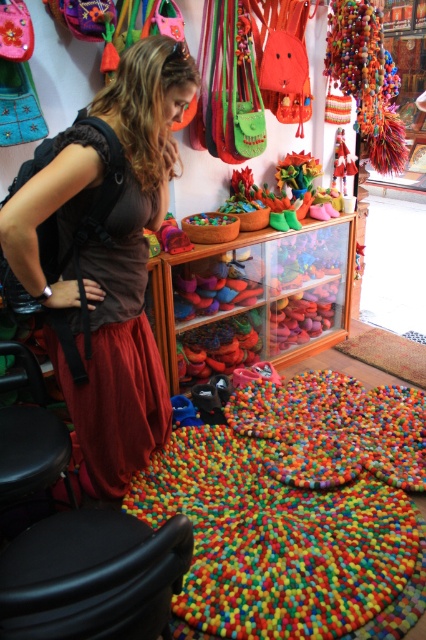
Question: Is black plastic stool at lower left wider than black leather stool at lower left?

Choices:
 (A) yes
 (B) no

Answer: (A)

Question: Can you confirm if brown fabric skirt at center is positioned above black leather stool at lower left?

Choices:
 (A) yes
 (B) no

Answer: (A)

Question: Which of these objects is positioned farthest from the black leather stool at lower left?

Choices:
 (A) black plastic stool at lower left
 (B) brown fabric skirt at center

Answer: (A)

Question: Is brown fabric skirt at center closer to the viewer compared to black plastic stool at lower left?

Choices:
 (A) yes
 (B) no

Answer: (B)

Question: Which of the following is the farthest from the observer?

Choices:
 (A) (63, 467)
 (B) (83, 205)
 (C) (132, 588)

Answer: (A)

Question: Which of the following is the closest to the observer?

Choices:
 (A) (157, 442)
 (B) (22, 557)
 (C) (54, 454)

Answer: (B)